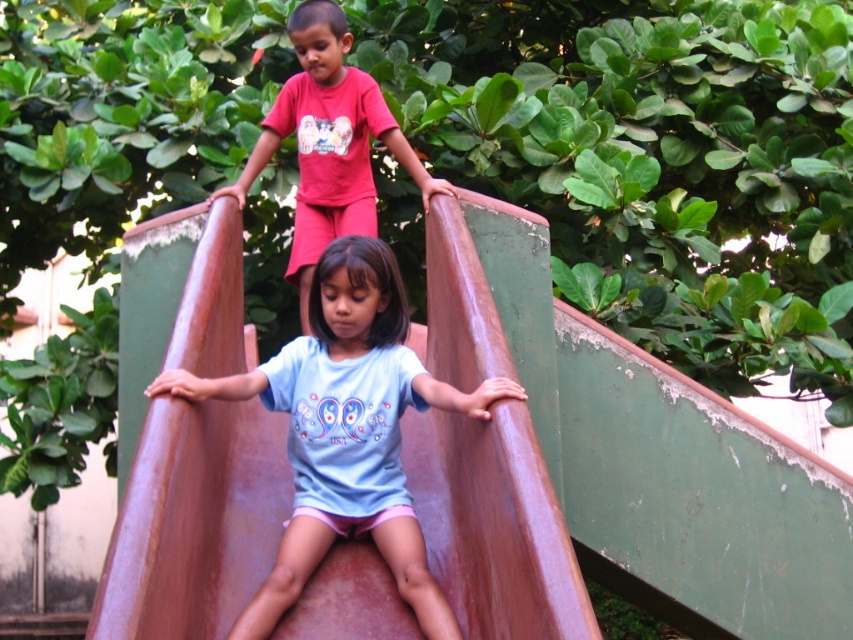
You are a parent watching your children play on the slide. You notice the light blue fabric shirt at center and the matte red pants at upper center. Which child is closer to you?

The light blue fabric shirt at center is closer to you because it is in front of the matte red pants at upper center.

You are a photographer trying to capture a photo of the two children on the slide. You notice two points marked on your camera screen at coordinates point (299,525) and point (241,177). Which point is closer to your camera lens?

Point (299,525) is closer to the camera lens than point (241,177).